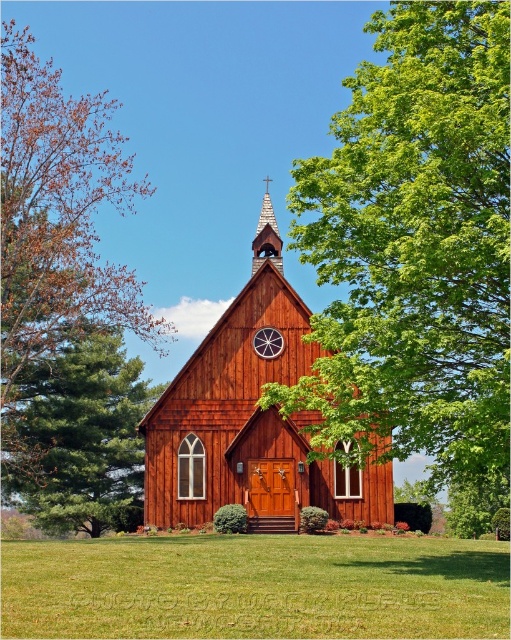
Which is in front, point (12, 432) or point (24, 401)?

Point (12, 432)

Measure the distance between point (x=29, y=353) and camera.

69.22 meters

In order to click on brown wood tree at left in this screenshot , I will do `click(56, 230)`.

I want to click on brown wood tree at left, so click(x=56, y=230).

How far apart are brown wood tree at left and wooden spire at upper center?

They are 9.89 meters apart.

Who is more distant from viewer, (65, 326) or (270, 208)?

Point (65, 326)

The image size is (511, 640). Identify the location of brown wood tree at left. (56, 230).

Describe the element at coordinates (56, 230) in the screenshot. Image resolution: width=511 pixels, height=640 pixels. I see `brown wood tree at left` at that location.

Between brown wood tree at left and wooden clock at center, which one appears on the left side from the viewer's perspective?

From the viewer's perspective, brown wood tree at left appears more on the left side.

I want to click on brown wood tree at left, so click(56, 230).